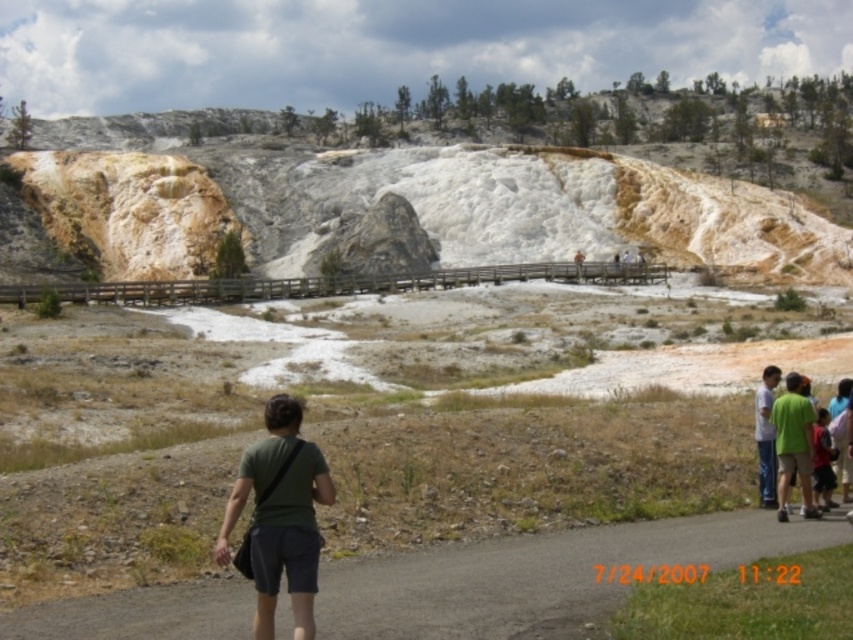
You are standing at the camera position and want to take a photo of two points in the scene. The first point is labeled as point (312, 502) and the second is point (798, 404). Which point will appear larger in your photo?

Point (312, 502) will appear larger in the photo because it is closer to the camera than point (798, 404).

You are standing at the starting point of the gray asphalt path at lower center. What is the 2D coordinate of your current position?

The 2D coordinate of the gray asphalt path at lower center is at point (538, 577).